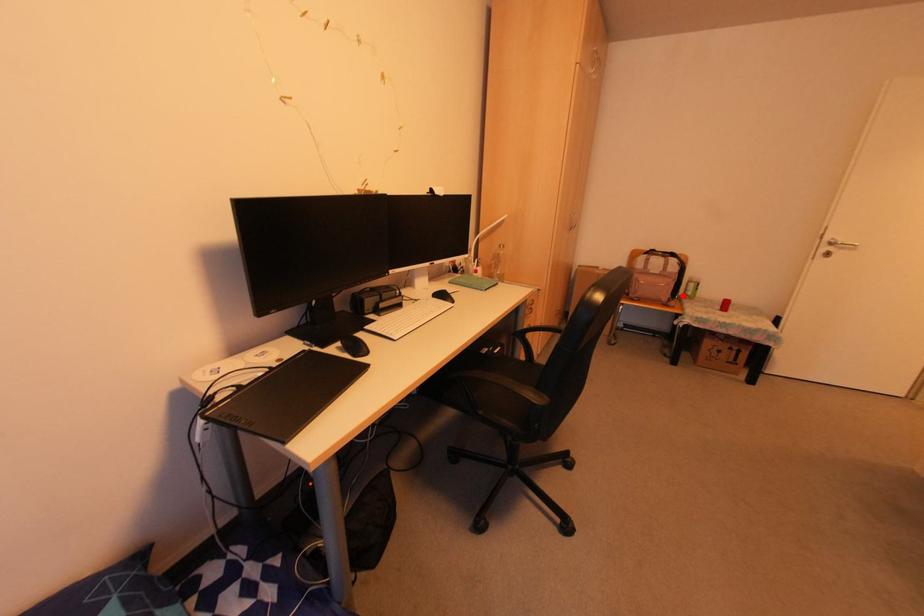
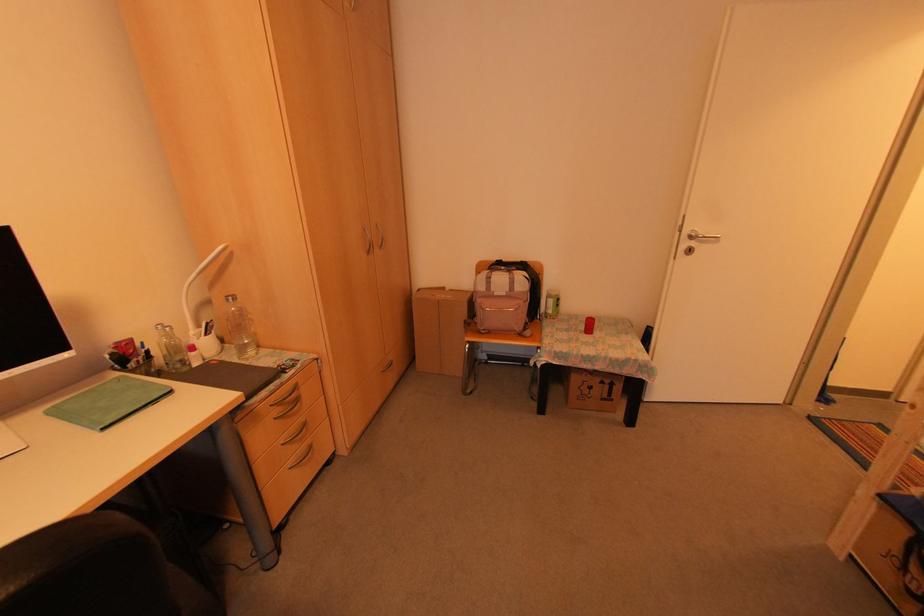
Question: I am providing you with two images of the same scene from different viewpoints. In image1, a red point is highlighted. Considering the same 3D point in image2, which of the following is correct?

Choices:
 (A) It is closer
 (B) It is farther

Answer: (B)